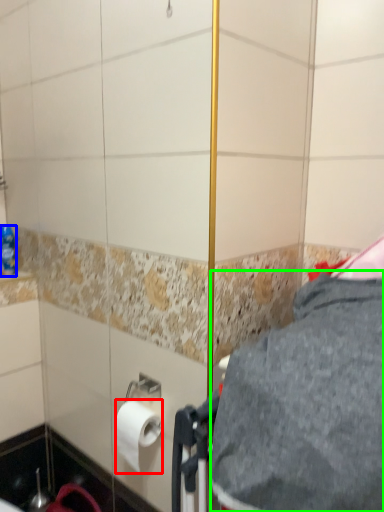
Question: Which is nearer to the toilet paper (highlighted by a red box)? bottle (highlighted by a blue box) or gray (highlighted by a green box).

Choices:
 (A) bottle
 (B) gray

Answer: (B)